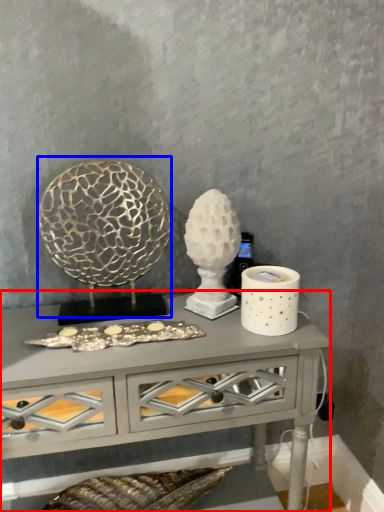
Question: Which point is closer to the camera, table (highlighted by a red box) or sculpture (highlighted by a blue box)?

Choices:
 (A) table
 (B) sculpture

Answer: (A)